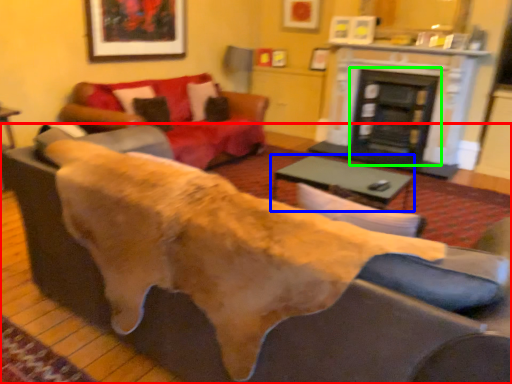
Question: Which is nearer to the studio couch (highlighted by a red box)? table (highlighted by a blue box) or fireplace (highlighted by a green box).

Choices:
 (A) table
 (B) fireplace

Answer: (A)